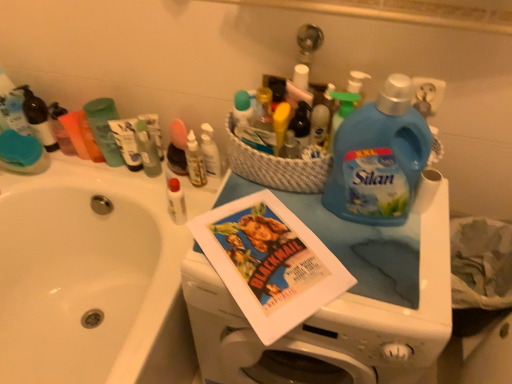
Question: Is green plastic shampoo bottle at upper left, which appears as the second toiletry when viewed from the right, at the right side of white paper at right?

Choices:
 (A) no
 (B) yes

Answer: (A)

Question: Can you confirm if green plastic shampoo bottle at upper left, which appears as the second toiletry when viewed from the right, is taller than white paper at right?

Choices:
 (A) yes
 (B) no

Answer: (A)

Question: Can you confirm if green plastic shampoo bottle at upper left, which appears as the second toiletry when viewed from the right, is bigger than white paper at right?

Choices:
 (A) yes
 (B) no

Answer: (A)

Question: Is white paper at right at the back of green plastic shampoo bottle at upper left, the 2th toiletry positioned from the left?

Choices:
 (A) no
 (B) yes

Answer: (A)

Question: Is green plastic shampoo bottle at upper left, the 2th toiletry positioned from the left, directly adjacent to white paper at right?

Choices:
 (A) yes
 (B) no

Answer: (B)

Question: Considering the positions of blue plastic laundry detergent at upper right and white glossy sink at left in the image, is blue plastic laundry detergent at upper right bigger or smaller than white glossy sink at left?

Choices:
 (A) small
 (B) big

Answer: (A)

Question: In terms of height, does blue plastic laundry detergent at upper right look taller or shorter compared to white glossy sink at left?

Choices:
 (A) tall
 (B) short

Answer: (A)

Question: In the image, is blue plastic laundry detergent at upper right on the left side or the right side of white glossy sink at left?

Choices:
 (A) right
 (B) left

Answer: (A)

Question: From the image's perspective, relative to white glossy sink at left, is blue plastic laundry detergent at upper right above or below?

Choices:
 (A) below
 (B) above

Answer: (A)

Question: Looking at their shapes, would you say blue plastic bottle at upper right, the first cleaning product viewed from the right, is wider or thinner than matte paper comic book at center?

Choices:
 (A) wide
 (B) thin

Answer: (B)

Question: Considering the positions of blue plastic bottle at upper right, the first cleaning product viewed from the right, and matte paper comic book at center in the image, is blue plastic bottle at upper right, the first cleaning product viewed from the right, bigger or smaller than matte paper comic book at center?

Choices:
 (A) small
 (B) big

Answer: (B)

Question: Is point (362, 200) positioned closer to the camera than point (309, 314)?

Choices:
 (A) closer
 (B) farther

Answer: (B)

Question: From a real-world perspective, is blue plastic bottle at upper right, the 2th cleaning product positioned from the left, physically located above or below matte paper comic book at center?

Choices:
 (A) above
 (B) below

Answer: (A)

Question: From a real-world perspective, is blue plastic bottle at upper right, the 2th cleaning product positioned from the left, above or below white paper at right?

Choices:
 (A) above
 (B) below

Answer: (A)

Question: Considering the positions of blue plastic bottle at upper right, the first cleaning product viewed from the right, and white paper at right in the image, is blue plastic bottle at upper right, the first cleaning product viewed from the right, bigger or smaller than white paper at right?

Choices:
 (A) small
 (B) big

Answer: (B)